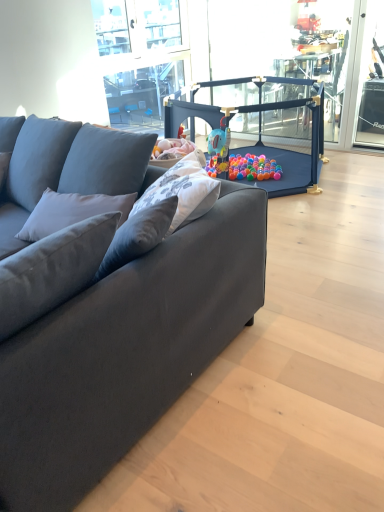
Question: Relative to suede dark gray couch at left, is clear glass window screen at right in front or behind?

Choices:
 (A) behind
 (B) front

Answer: (A)

Question: Is clear glass window screen at right situated inside suede dark gray couch at left or outside?

Choices:
 (A) outside
 (B) inside

Answer: (A)

Question: Estimate the real-world distances between objects in this image. Which object is farther from the clear glass window screen at right?

Choices:
 (A) suede dark gray couch at left
 (B) matte blue playpen at center

Answer: (A)

Question: Which object is positioned closest to the matte blue playpen at center?

Choices:
 (A) clear glass window screen at right
 (B) suede dark gray couch at left

Answer: (A)